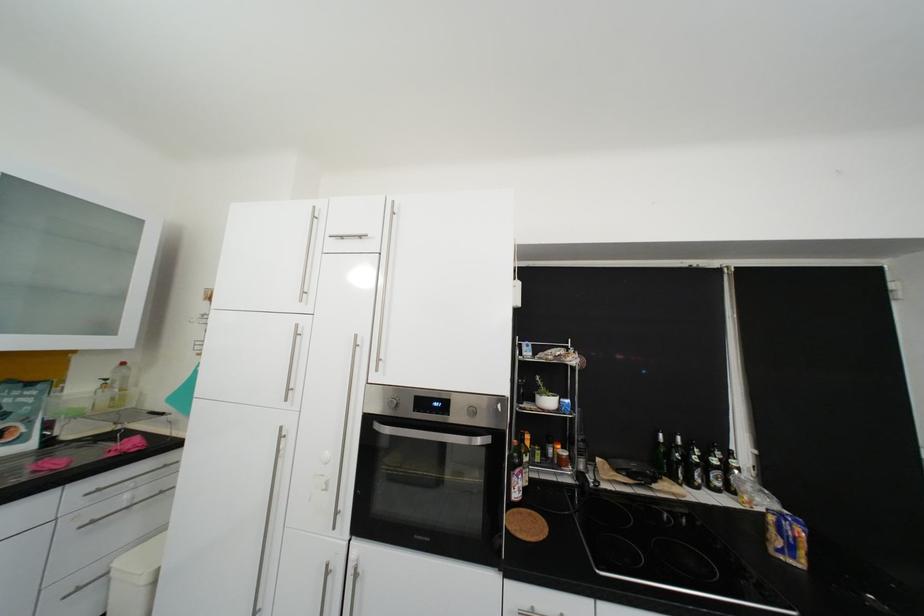
You are a GUI agent. You are given a task and a screenshot of the screen. Output one action in this format:
    pyautogui.click(x=<x>, y=<y>)
    Task: Click on the metal cabinet handle
    This screenshot has height=616, width=924.
    Given the screenshot: What is the action you would take?
    pyautogui.click(x=323, y=586)